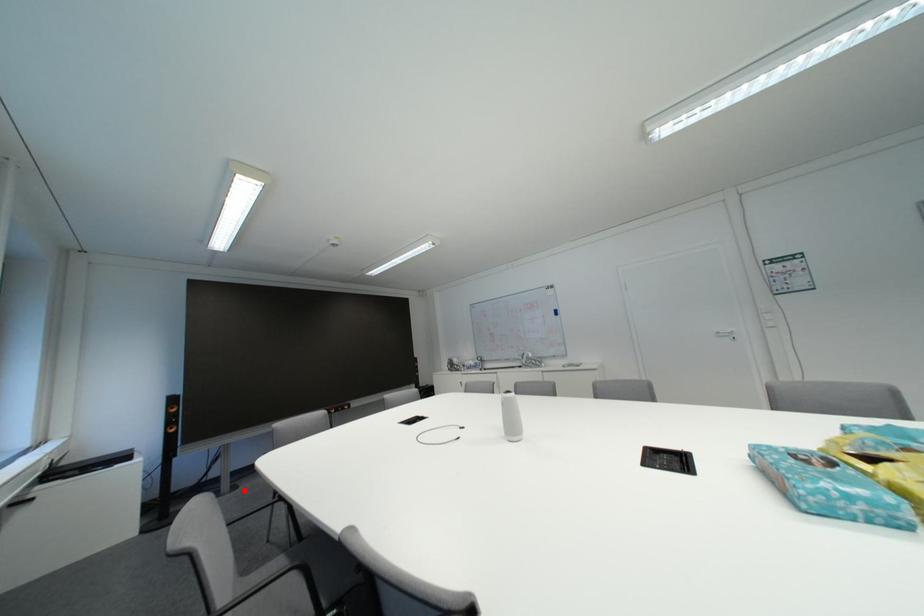
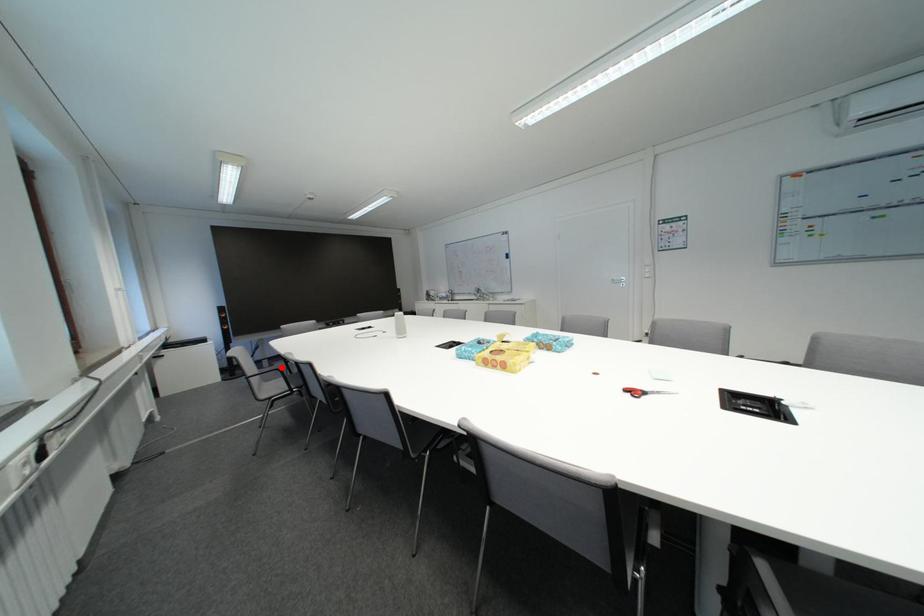
I am providing you with two images of the same scene from different viewpoints. A red point is marked on the first image and another point is marked on the second image. Is the marked point in image1 the same physical position as the marked point in image2?

Yes